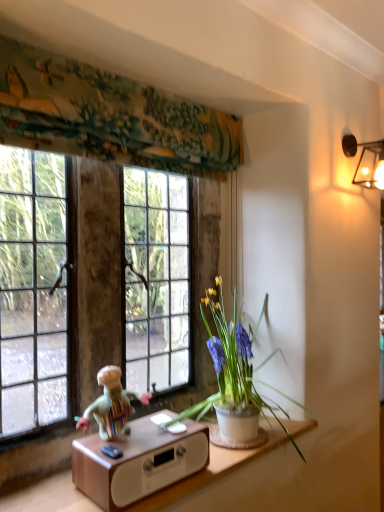
You are a GUI agent. You are given a task and a screenshot of the screen. Output one action in this format:
    pyautogui.click(x=<x>, y=<y>)
    Task: Click on the vacant area located to the right-hand side of multicolored fabric doll at lower center
    Image resolution: width=384 pixels, height=512 pixels.
    Given the screenshot: What is the action you would take?
    pyautogui.click(x=165, y=435)